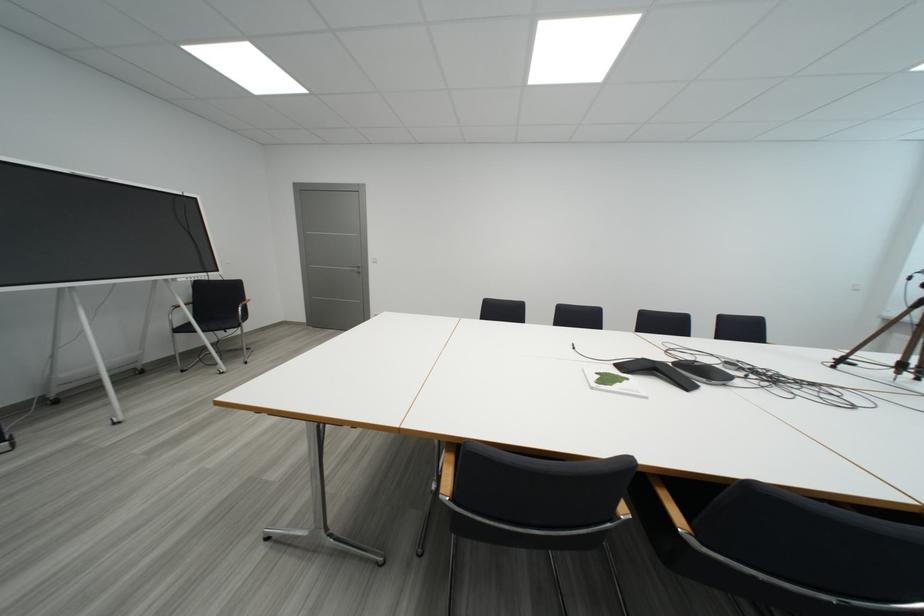
Which object does [612,382] point to?

It corresponds to the white notebook in the image.